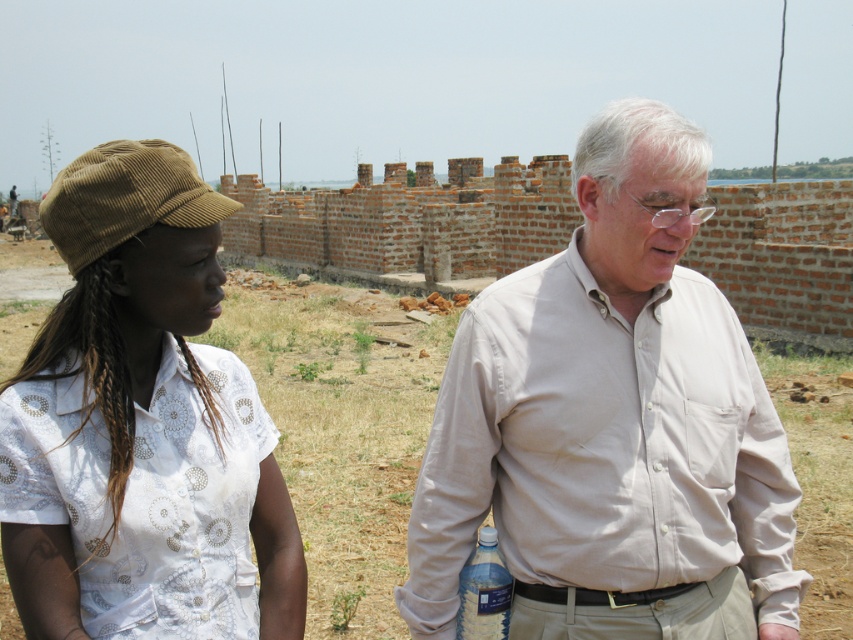
You are a photographer trying to capture a closeup of the clear plastic bottle at lower center without the beige cotton shirt at center overlapping it. Given their sizes, is this possible?

The beige cotton shirt at center is wider than the clear plastic bottle at lower center, so it might block the view. Move the camera angle to the side to avoid overlap.

You are a delivery person who needs to place a small package between the beige cotton shirt at center and the clear plastic bottle at lower center. Can you fit it there?

The distance between the beige cotton shirt at center and the clear plastic bottle at lower center is 10.09 inches, so yes, the small package can be placed there as it likely fits within that space.

Based on the photo, you are a photographer trying to capture a portrait of both the beige cotton shirt at center and the brown corduroy cap at left. Since you want both subjects to be fully visible in the frame, does the current arrangement allow you to include both in the photo without cropping either?

The beige cotton shirt at center is below the brown corduroy cap at left, so yes, the photographer can capture both in the frame as they are positioned vertically aligned without overlapping.